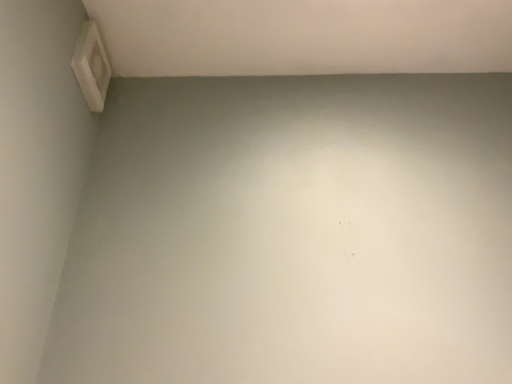
What do you see at coordinates (91, 66) in the screenshot? I see `white plastic window at upper left` at bounding box center [91, 66].

Identify the location of white plastic window at upper left. This screenshot has width=512, height=384. (91, 66).

You are a GUI agent. You are given a task and a screenshot of the screen. Output one action in this format:
    pyautogui.click(x=<x>, y=<y>)
    Task: Click on the white plastic window at upper left
    The height and width of the screenshot is (384, 512).
    Given the screenshot: What is the action you would take?
    pyautogui.click(x=91, y=66)